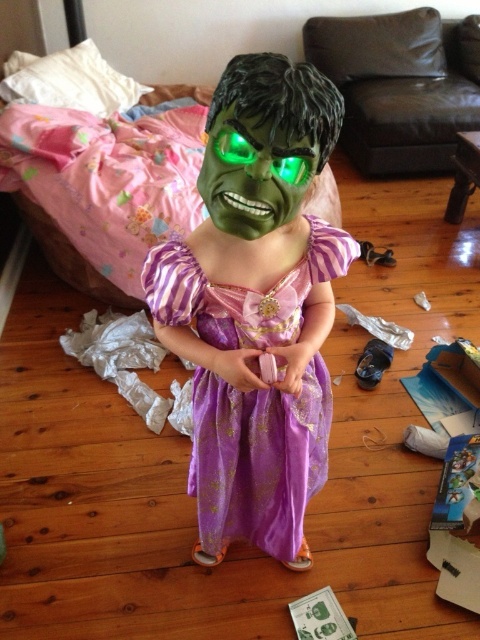
Can you confirm if purple satin dress at center is positioned above green matte mask at center?

No.

Who is taller, purple satin dress at center or green matte mask at center?

purple satin dress at center is taller.

Between point (216, 531) and point (302, 166), which one is positioned behind?

Positioned behind is point (216, 531).

Locate an element on the screen. This screenshot has height=640, width=480. purple satin dress at center is located at coordinates (256, 460).